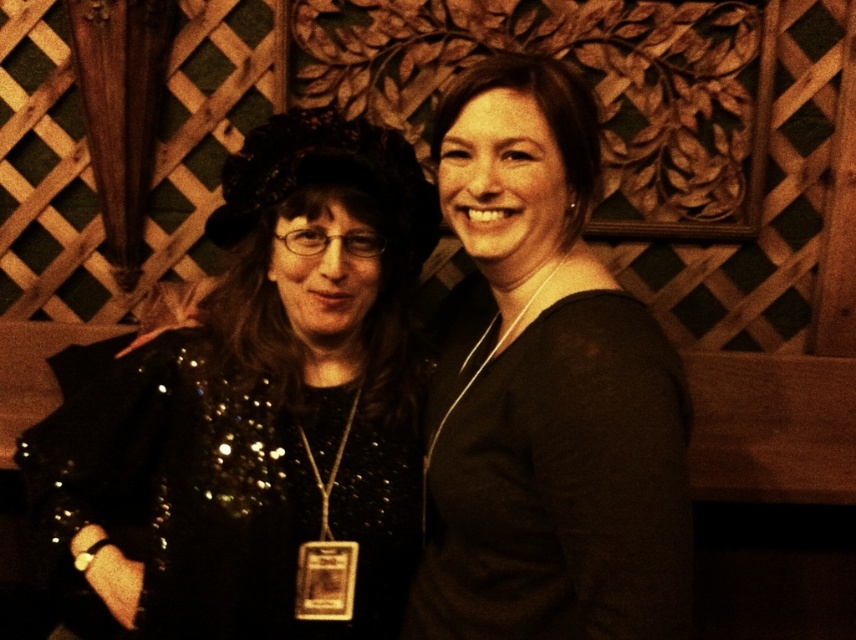
You are a photographer setting up for an event. You need to position a light source to the right of the black sequined dress at left. According to the coordinates provided, where should you place the light relative to the dress?

The black sequined dress at left is located at point (265, 408). To place the light source to the right of it, position the light to the right side of the black sequined dress at left based on its coordinates.

You are organizing a photo shoot and need to ensure that the black sequined dress at left and the black matte dress at center are positioned appropriately. Based on the scene description, which dress should be placed closer to the camera to ensure they appear the same width in the final photograph?

The black sequined dress at left might be wider than the black matte dress at center, so to make them appear the same width in the photo, the black sequined dress at left should be placed farther from the camera than the black matte dress at center.

You are a photographer trying to capture a clear shot of both the black sequined dress at left and the black matte dress at center. Since you want both dresses to be in focus, which one should you adjust your camera focus on first?

The black sequined dress at left is closer to you than the black matte dress at center, so you should focus on the black sequined dress at left first to ensure both are in focus.